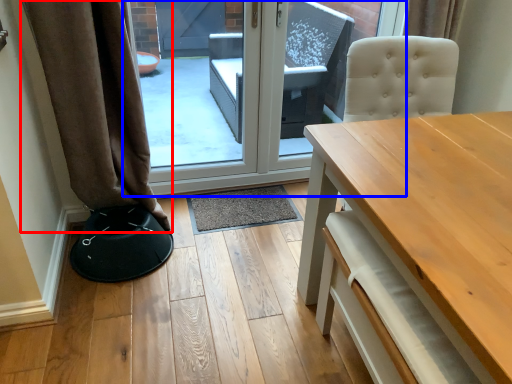
Question: Which of the following is the closest to the observer, curtain (highlighted by a red box) or door (highlighted by a blue box)?

Choices:
 (A) curtain
 (B) door

Answer: (A)